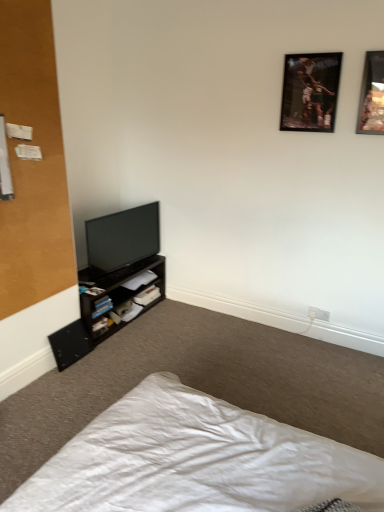
Question: From a real-world perspective, relative to dark brown wooden shelf at lower left, is wooden picture frame at upper right, acting as the 2th picture frame starting from the left, vertically above or below?

Choices:
 (A) above
 (B) below

Answer: (A)

Question: Based on their sizes in the image, would you say wooden picture frame at upper right, marked as the first picture frame in a right-to-left arrangement, is bigger or smaller than dark brown wooden shelf at lower left?

Choices:
 (A) small
 (B) big

Answer: (A)

Question: Which is farther from the white matte book at lower left, acting as the third book starting from the bottom?

Choices:
 (A) black matte speaker at lower left
 (B) hardcover book at lower left, which appears as the third book when viewed from the top
 (C) wooden-framed picture at upper right, the first picture frame in the left-to-right sequence
 (D) white fabric bed at lower left
 (E) white paper at lower center, the second book in the bottom-to-top sequence

Answer: (D)

Question: Which of these objects is positioned closest to the wooden picture frame at upper right, marked as the first picture frame in a right-to-left arrangement?

Choices:
 (A) white plastic electric outlet at lower right
 (B) dark brown wooden shelf at lower left
 (C) black matte speaker at lower left
 (D) hardcover book at lower left, which appears as the third book when viewed from the top
 (E) white matte book at lower left, acting as the third book starting from the bottom

Answer: (A)